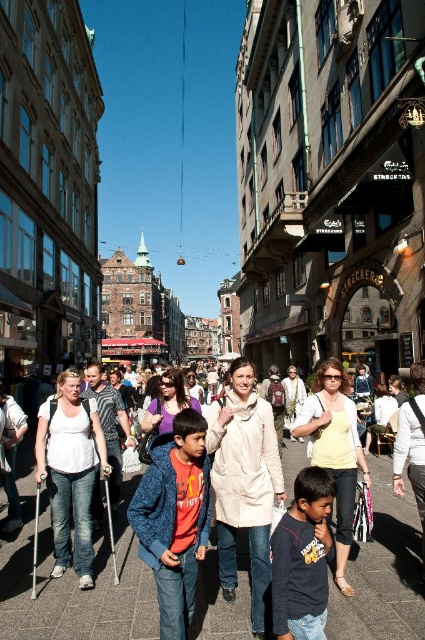
Between smooth concrete pavement at center and blue fleece jacket at center, which one has more height?

With more height is blue fleece jacket at center.

Can you confirm if smooth concrete pavement at center is thinner than blue fleece jacket at center?

In fact, smooth concrete pavement at center might be wider than blue fleece jacket at center.

Is point (135, 483) farther from viewer compared to point (146, 556)?

That is True.

Find the location of a particular element. This screenshot has width=425, height=640. smooth concrete pavement at center is located at coordinates (74, 588).

Can you confirm if smooth concrete pavement at center is positioned to the right of dark blue cotton shirt at center?

In fact, smooth concrete pavement at center is to the left of dark blue cotton shirt at center.

Identify the location of smooth concrete pavement at center. This screenshot has height=640, width=425. (74, 588).

Who is more forward, (x=104, y=611) or (x=308, y=616)?

Point (x=308, y=616) is in front.

At what (x,y) coordinates should I click in order to perform the action: click on smooth concrete pavement at center. Please return your answer as a coordinate pair (x, y). Looking at the image, I should click on (74, 588).

Is point (180, 520) positioned in front of point (294, 516)?

No, it is not.

Which is below, blue fleece jacket at center or dark blue cotton shirt at center?

dark blue cotton shirt at center is lower down.

Who is more forward, (170, 545) or (305, 490)?

Point (305, 490) is in front.

Where is `blue fleece jacket at center`? The height and width of the screenshot is (640, 425). blue fleece jacket at center is located at coordinates [175, 518].